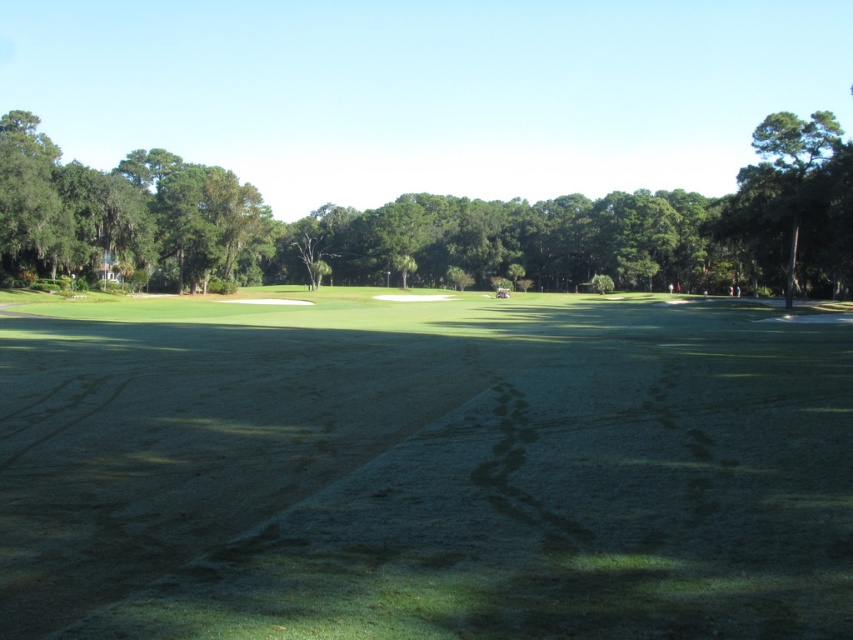
How distant is green grass at center from green leafy tree at upper right?

They are 45.20 meters apart.

Who is shorter, green grass at center or green leafy tree at upper right?

Standing shorter between the two is green grass at center.

This screenshot has width=853, height=640. I want to click on green grass at center, so click(422, 468).

Where is `green grass at center`? green grass at center is located at coordinates (422, 468).

The width and height of the screenshot is (853, 640). In order to click on green grass at center in this screenshot , I will do `click(422, 468)`.

Who is positioned more to the right, green grass at center or green leafy tree at center?

green grass at center

Is point (401, 420) positioned behind point (728, 241)?

No, (401, 420) is closer to viewer.

The height and width of the screenshot is (640, 853). Identify the location of green grass at center. (422, 468).

Is green leafy tree at center to the left of green leafy tree at upper right from the viewer's perspective?

Indeed, green leafy tree at center is positioned on the left side of green leafy tree at upper right.

You are a GUI agent. You are given a task and a screenshot of the screen. Output one action in this format:
    pyautogui.click(x=<x>, y=<y>)
    Task: Click on the green leafy tree at center
    The width and height of the screenshot is (853, 640).
    Given the screenshot: What is the action you would take?
    pyautogui.click(x=430, y=227)